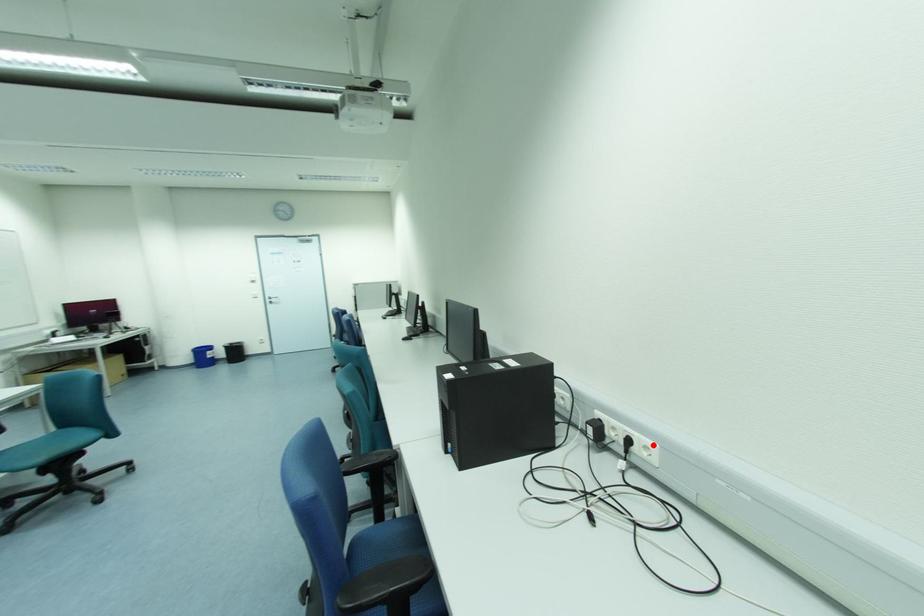
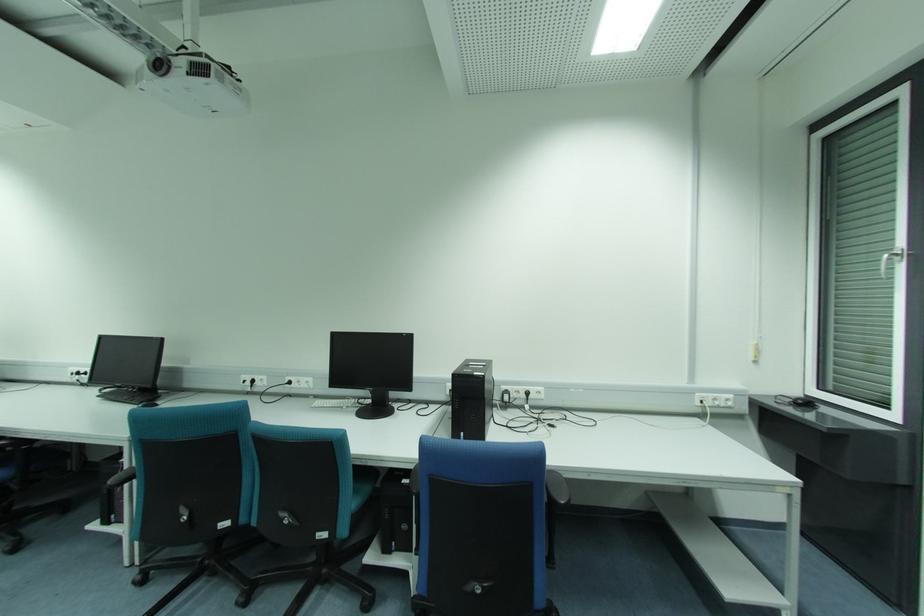
Where in the second image is the point corresponding to the highlighted location from the first image?

(541, 389)